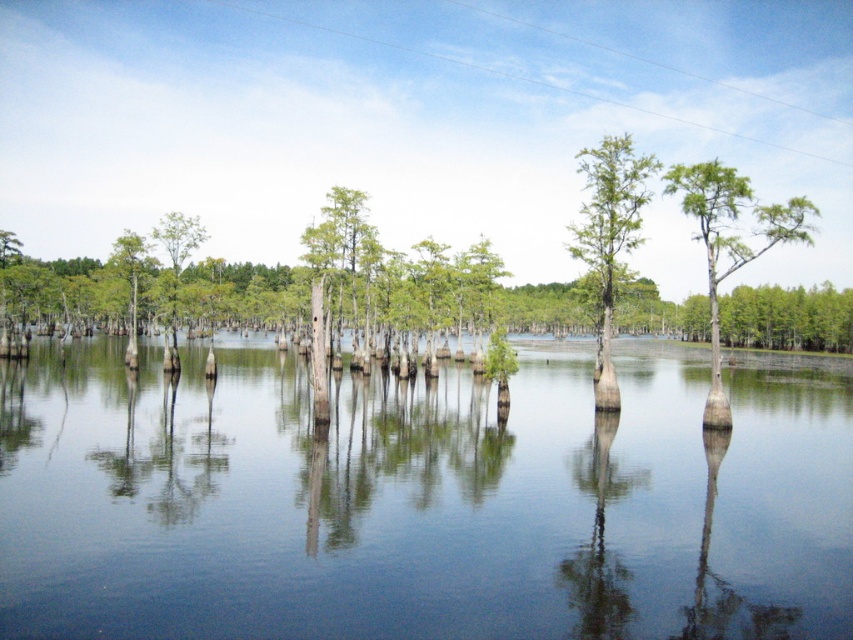
Question: Does clear water at center have a larger size compared to green matte tree at center?

Choices:
 (A) no
 (B) yes

Answer: (A)

Question: Among these points, which one is farthest from the camera?

Choices:
 (A) (614, 248)
 (B) (526, 404)

Answer: (B)

Question: Which of the following is the farthest from the observer?

Choices:
 (A) (264, 429)
 (B) (618, 394)

Answer: (B)

Question: Does clear water at center appear over green matte tree at center?

Choices:
 (A) yes
 (B) no

Answer: (B)

Question: Does clear water at center appear on the left side of green matte tree at center?

Choices:
 (A) yes
 (B) no

Answer: (A)